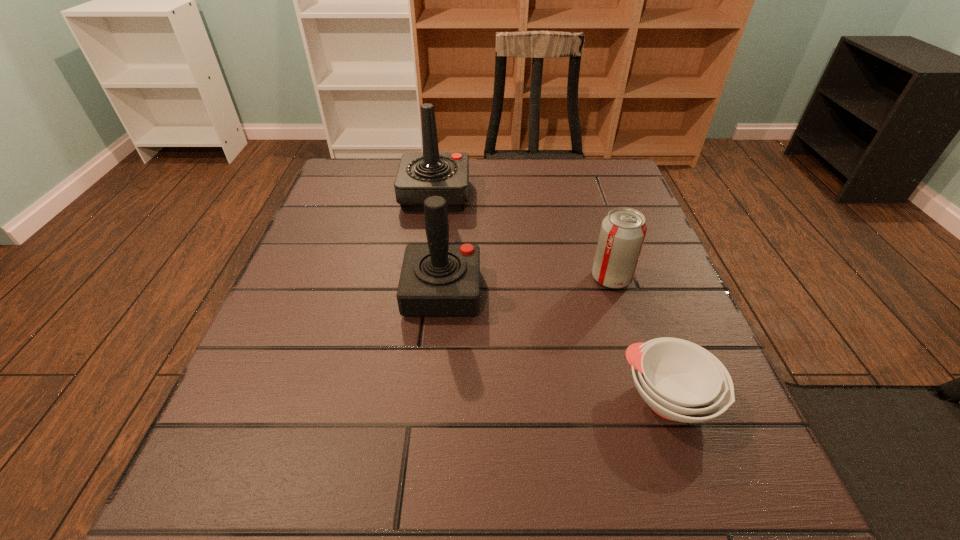
You are a GUI agent. You are given a task and a screenshot of the screen. Output one action in this format:
    pyautogui.click(x=<x>, y=<y>)
    Task: Click on the soda can that is at the right edge
    The width and height of the screenshot is (960, 540).
    Given the screenshot: What is the action you would take?
    pyautogui.click(x=623, y=230)

I want to click on soup bowl that is positioned at the right edge, so click(x=681, y=381).

At what (x,y) coordinates should I click in order to perform the action: click on vacant space at the far edge of the desktop. Please return your answer as a coordinate pair (x, y). Image resolution: width=960 pixels, height=540 pixels. Looking at the image, I should click on (521, 186).

This screenshot has height=540, width=960. I want to click on vacant point at the left edge, so click(x=354, y=233).

Identify the location of vacant space at the right edge of the desktop. The image size is (960, 540). (709, 352).

You are a GUI agent. You are given a task and a screenshot of the screen. Output one action in this format:
    pyautogui.click(x=<x>, y=<y>)
    Task: Click on the free space at the far right corner of the desktop
    This screenshot has height=540, width=960.
    Given the screenshot: What is the action you would take?
    pyautogui.click(x=580, y=202)

The height and width of the screenshot is (540, 960). What are the coordinates of `vacant area that lies between the farthest object and the soup bowl` in the screenshot? It's located at (552, 296).

At what (x,y) coordinates should I click in order to perform the action: click on empty space between the nearer joystick and the nearest object. Please return your answer as a coordinate pair (x, y). The width and height of the screenshot is (960, 540). Looking at the image, I should click on (556, 345).

Find the location of `vacant area that lies between the nearest object and the farthest object`. vacant area that lies between the nearest object and the farthest object is located at coordinates (552, 296).

Image resolution: width=960 pixels, height=540 pixels. Find the location of `free space between the third tallest object and the nearer joystick`. free space between the third tallest object and the nearer joystick is located at coordinates (527, 285).